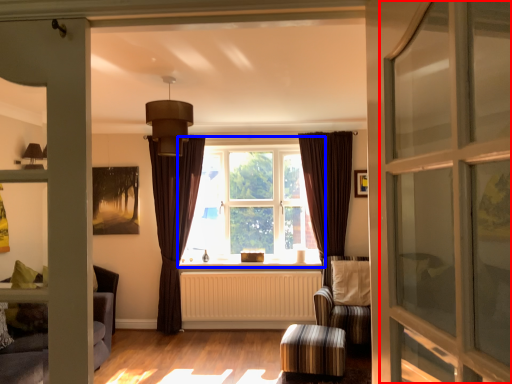
Question: Among these objects, which one is nearest to the camera, screen door (highlighted by a red box) or window (highlighted by a blue box)?

Choices:
 (A) screen door
 (B) window

Answer: (A)